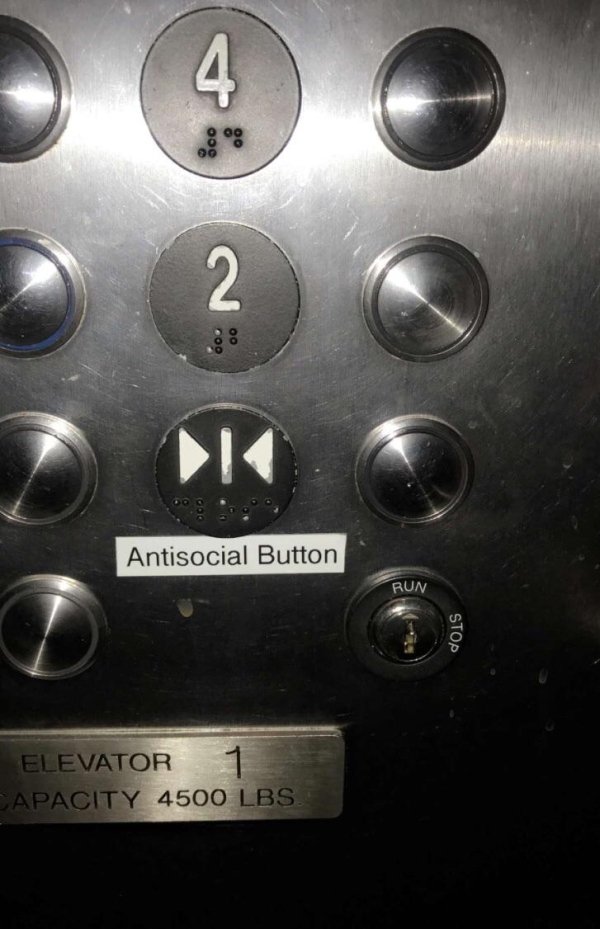
Locate an element on the screen. The width and height of the screenshot is (600, 929). keyhole is located at coordinates (415, 632).